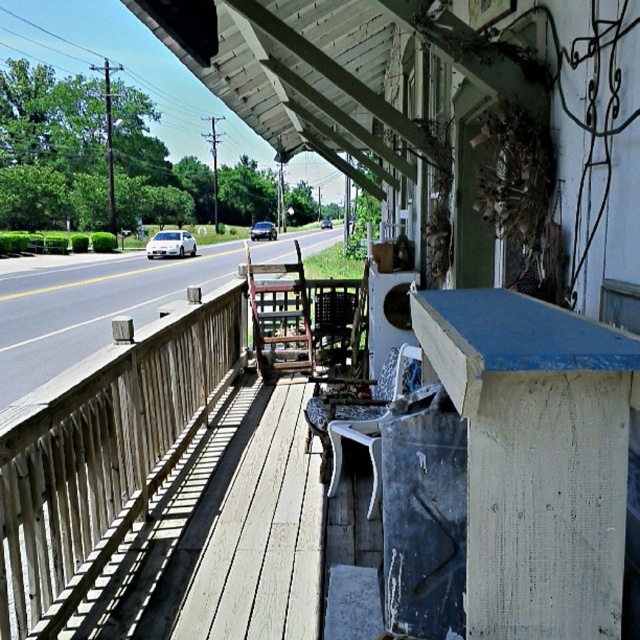
You are standing on the porch and want to sit down. You see a white plastic rocking chair at center and a wooden chair at center. Which chair is directly above the other?

The white plastic rocking chair at center is positioned under the wooden chair at center, so the wooden chair at center is directly above the white plastic rocking chair at center.

You are standing on the porch and want to sit down. The white plastic rocking chair at center is located at point (x=369, y=416). Is there any object at that point that you can sit on?

Yes, the point (x=369, y=416) corresponds to the white plastic rocking chair at center, which is an object you can sit on.